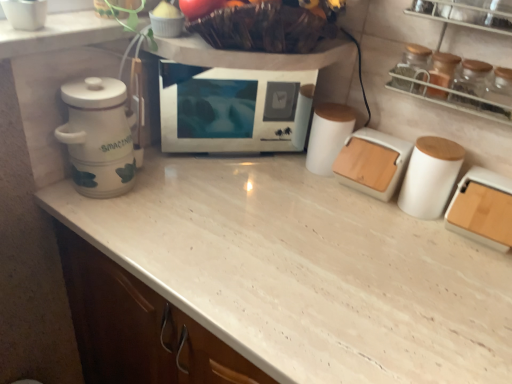
The width and height of the screenshot is (512, 384). Find the location of `vacant space situated on the left part of white matte bread bin at center-right, acting as the 1th kitchen appliance starting from the left`. vacant space situated on the left part of white matte bread bin at center-right, acting as the 1th kitchen appliance starting from the left is located at coordinates (289, 187).